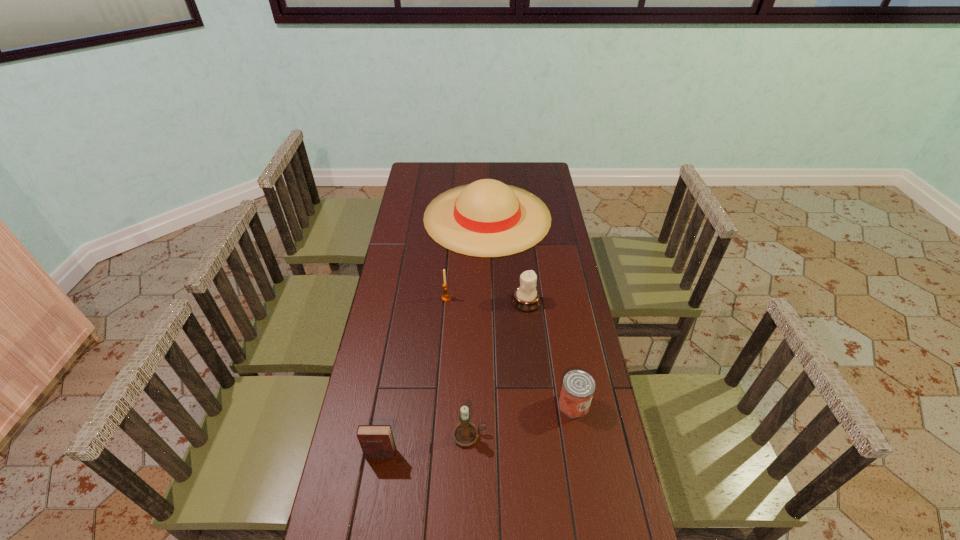
Locate an element on the screen. Image resolution: width=960 pixels, height=540 pixels. vacant space located 0.230m on the back of the leftmost candle holder is located at coordinates (449, 255).

Where is `free region located 0.070m on the front of the rightmost candle holder`? The height and width of the screenshot is (540, 960). free region located 0.070m on the front of the rightmost candle holder is located at coordinates (529, 327).

You are a GUI agent. You are given a task and a screenshot of the screen. Output one action in this format:
    pyautogui.click(x=<x>, y=<y>)
    Task: Click on the vacant space situated 0.260m on the side of the nearest candle holder with the handle
    This screenshot has width=960, height=540.
    Given the screenshot: What is the action you would take?
    pyautogui.click(x=579, y=435)

You are a GUI agent. You are given a task and a screenshot of the screen. Output one action in this format:
    pyautogui.click(x=<x>, y=<y>)
    Task: Click on the vacant region located on the front cover of the diary
    
    Given the screenshot: What is the action you would take?
    pyautogui.click(x=372, y=505)

Find the location of a particular element. The height and width of the screenshot is (540, 960). free space located 0.160m on the back of the can is located at coordinates (564, 349).

Locate an element on the screen. object located at the far edge is located at coordinates (487, 218).

Where is `sombrero that is positioned at the left edge`? sombrero that is positioned at the left edge is located at coordinates (487, 218).

Find the location of `diary located at the left edge`. diary located at the left edge is located at coordinates (377, 442).

This screenshot has width=960, height=540. I want to click on sombrero located in the right edge section of the desktop, so click(x=487, y=218).

The image size is (960, 540). I want to click on candle holder present at the right edge, so click(526, 298).